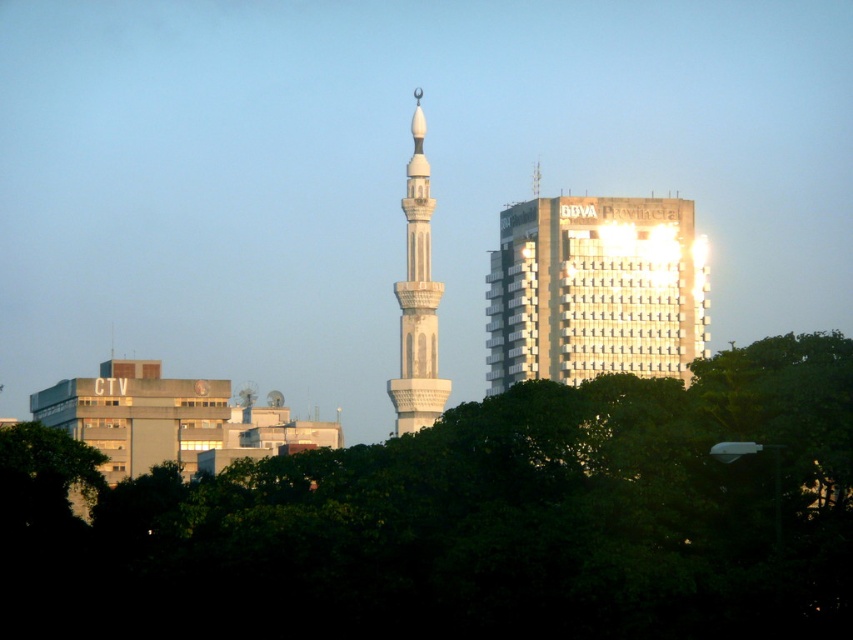
You are a photographer trying to capture the white marble minaret at center without the green leafy tree at lower center blocking it. Based on the scene, can you position yourself in a way that allows you to photograph the minaret clearly?

The white marble minaret at center is behind the green leafy tree at lower center, so you can move to a position where the tree is out of the frame or adjust your angle to capture the minaret without obstruction.

You are standing at a viewpoint overlooking the city. There is a point marked at coordinates point (531, 481). If you want to take a photo that includes both the point and the CTV building, which is located to the left in the midground, should you adjust your camera to focus closer or farther away?

The point (531, 481) is 650.13 meters away from the camera. Since the CTV building is in the midground, which is closer than the background but farther than the foreground, you need to ensure both are in focus. However, without knowing the exact distance of the CTV building, it is difficult to determine the adjustment. But since the point is already at 650.13 meters, if the CTV building is closer, you might need to focus somewhere in between or use a larger depth of field.

You are standing in the city park and want to take a photo of the white glass building at upper center and the white marble minaret at center. Which one will appear closer to you in the photo?

The white glass building at upper center will appear closer to you in the photo because it is positioned closer to the viewer compared to the white marble minaret at center.